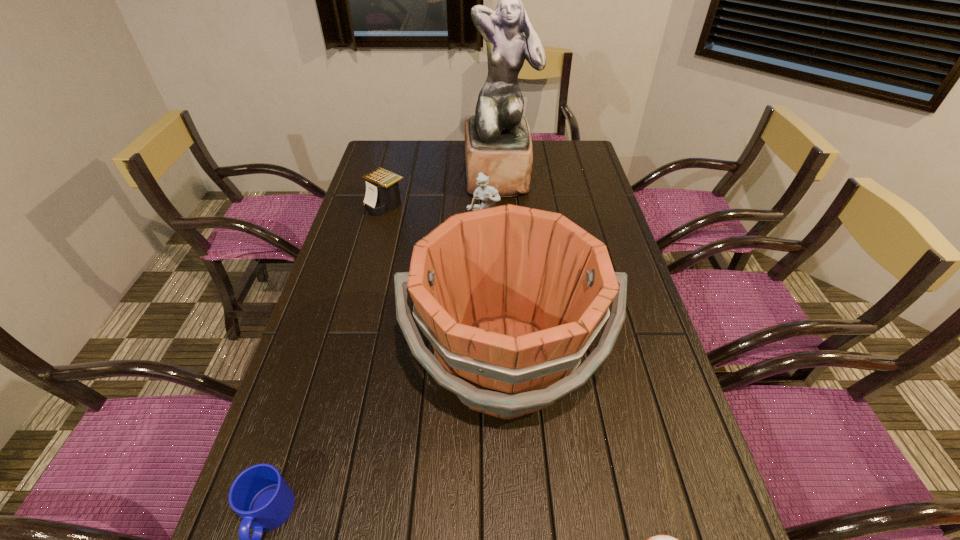
Identify the location of the tallest object. [498, 143].

Identify the location of bucket. The height and width of the screenshot is (540, 960). (510, 297).

Where is `the third nearest object`? This screenshot has height=540, width=960. the third nearest object is located at coordinates (510, 297).

Locate an element on the screen. The image size is (960, 540). the fourth nearest object is located at coordinates (485, 193).

The width and height of the screenshot is (960, 540). Identify the location of the fourth shortest object. (485, 193).

Find the location of a particular element. The image size is (960, 540). calculator is located at coordinates (382, 195).

This screenshot has width=960, height=540. Identify the location of free space located in a relaxed pose on the tallest object. (502, 227).

At what (x,y) coordinates should I click in order to perform the action: click on blank space located 0.110m on the handle side of the fourth farthest object. Please return your answer as a coordinate pair (x, y). The image size is (960, 540). Looking at the image, I should click on (512, 502).

Find the location of a particular element. free space located on the front-facing side of the fourth nearest object is located at coordinates (483, 270).

Image resolution: width=960 pixels, height=540 pixels. I want to click on vacant space situated on the right of the third shortest object, so click(x=512, y=204).